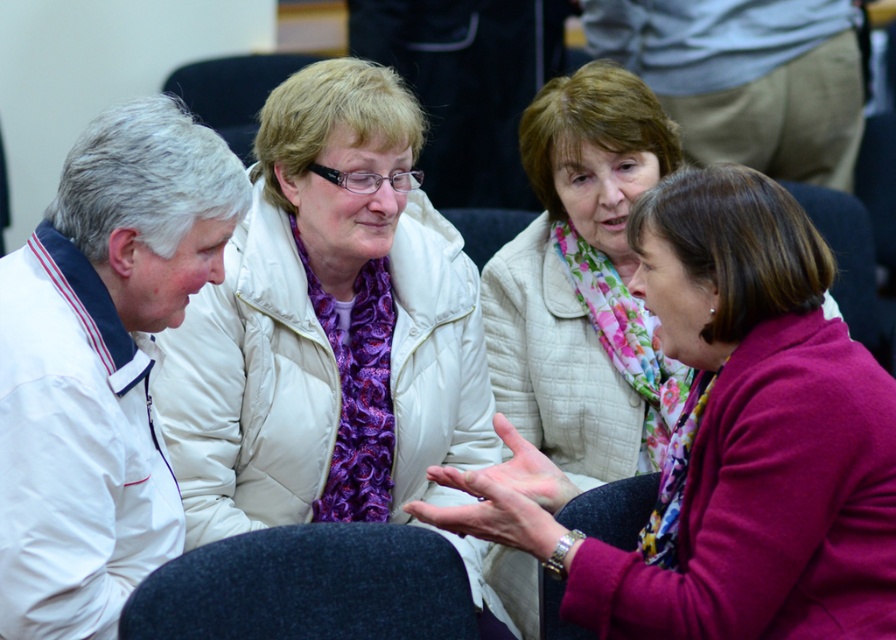
Question: Can you confirm if floral scarf at center is positioned to the right of white quilted jacket at upper center?

Choices:
 (A) yes
 (B) no

Answer: (A)

Question: Does floral scarf at center appear on the right side of white quilted jacket at upper center?

Choices:
 (A) no
 (B) yes

Answer: (B)

Question: Which point is farther to the camera?

Choices:
 (A) white quilted jacket at upper center
 (B) floral scarf at center

Answer: (A)

Question: Among these objects, which one is farthest from the camera?

Choices:
 (A) floral scarf at center
 (B) white quilted jacket at upper center

Answer: (B)

Question: Is floral scarf at center below white quilted jacket at upper center?

Choices:
 (A) yes
 (B) no

Answer: (A)

Question: Which object is farther from the camera taking this photo?

Choices:
 (A) floral scarf at center
 (B) white quilted jacket at upper center

Answer: (B)